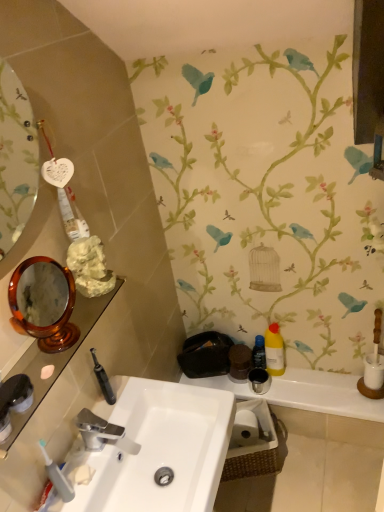
At what (x,y) coordinates should I click in order to perform the action: click on free location to the right of black plastic bottle at right, the 1th mouthwash in the left-to-right sequence. Please return your answer as a coordinate pair (x, y). Looking at the image, I should click on [x=312, y=375].